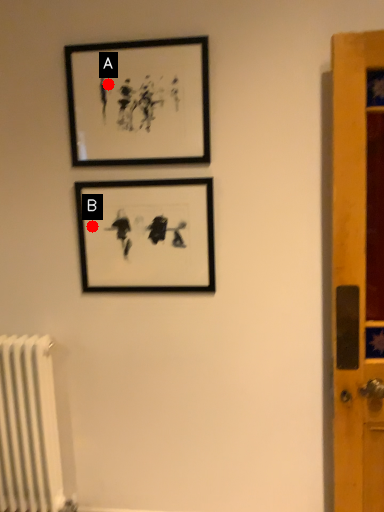
Question: Two points are circled on the image, labeled by A and B beside each circle. Which point is closer to the camera?

Choices:
 (A) A is closer
 (B) B is closer

Answer: (A)